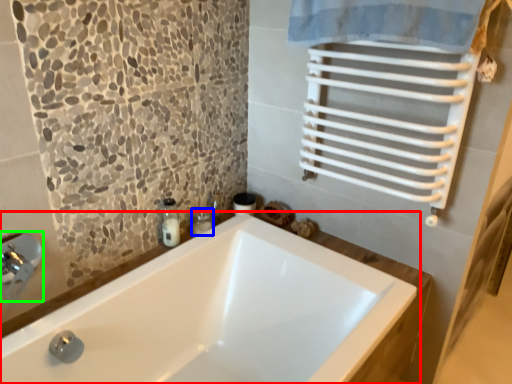
Question: Which object is positioned closest to bathtub (highlighted by a red box)? Select from toiletry (highlighted by a blue box) and faucet (highlighted by a green box).

Choices:
 (A) toiletry
 (B) faucet

Answer: (A)